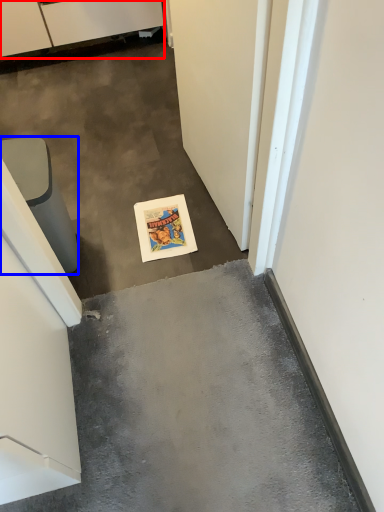
Question: Among these objects, which one is nearest to the camera, cabinetry (highlighted by a red box) or furniture (highlighted by a blue box)?

Choices:
 (A) cabinetry
 (B) furniture

Answer: (B)